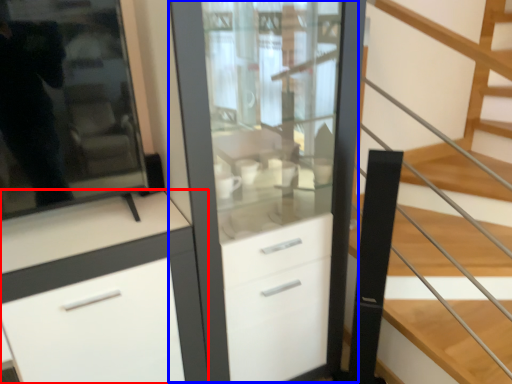
Question: Which of the following is the farthest to the observer, cabinetry (highlighted by a red box) or dresser (highlighted by a blue box)?

Choices:
 (A) cabinetry
 (B) dresser

Answer: (B)